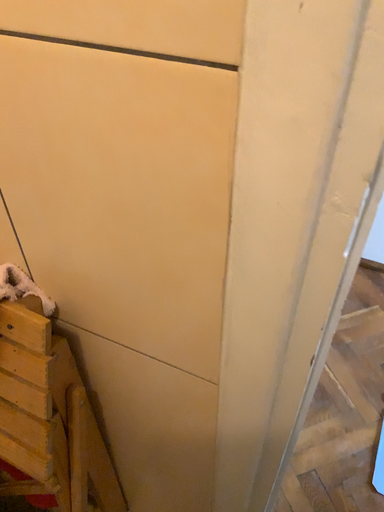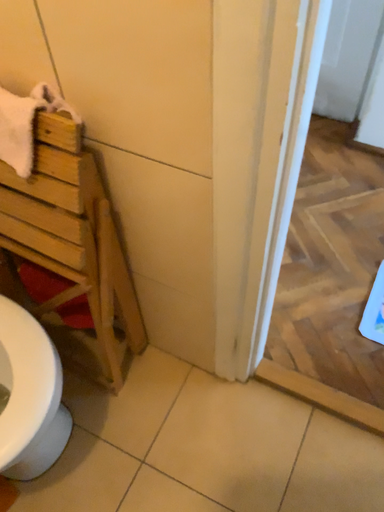
Question: Which way did the camera rotate in the video?

Choices:
 (A) rotated upward
 (B) rotated downward

Answer: (B)